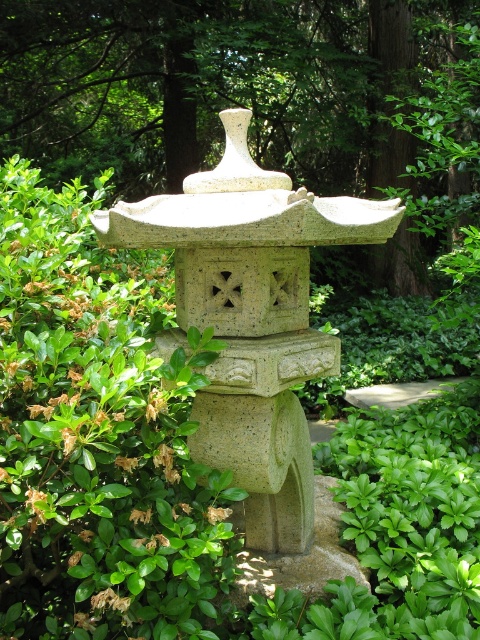
Between green leafy bush at center and gray stone statue at center, which one appears on the left side from the viewer's perspective?

green leafy bush at center

Is green leafy bush at center wider than gray stone statue at center?

No.

Locate an element on the screen. The height and width of the screenshot is (640, 480). green leafy bush at center is located at coordinates (98, 436).